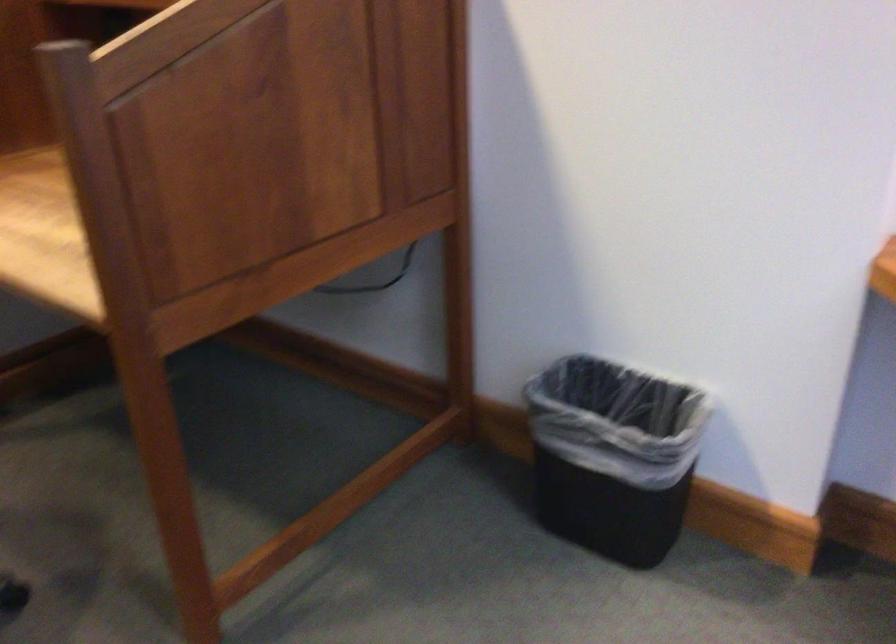
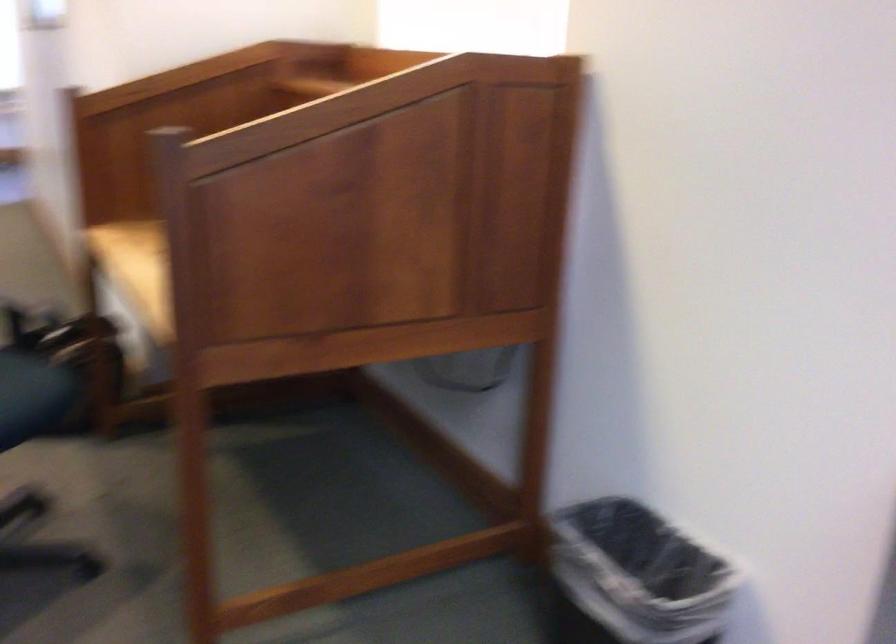
Question: The images are taken continuously from a first-person perspective. In which direction are you moving?

Choices:
 (A) Left
 (B) Right
 (C) Forward
 (D) Backward

Answer: (B)